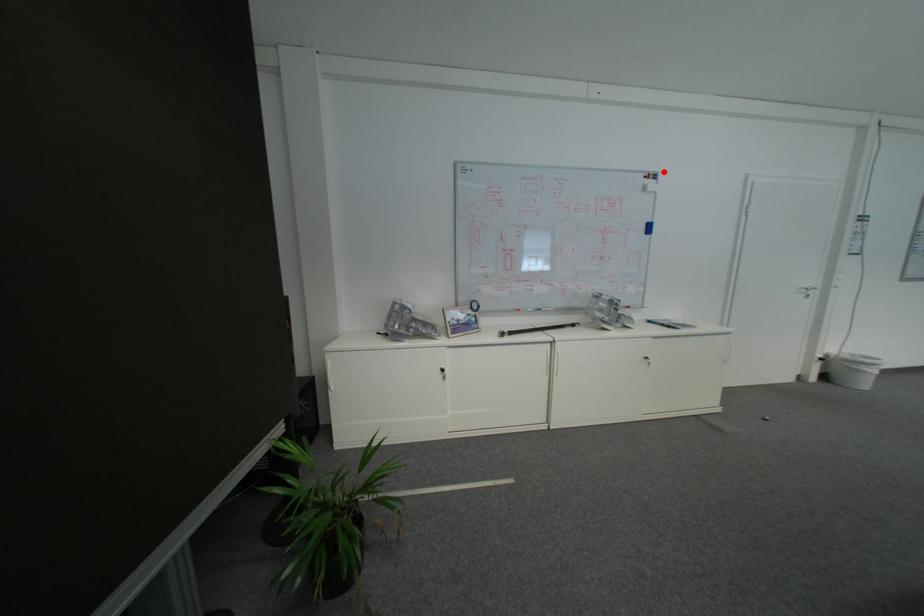
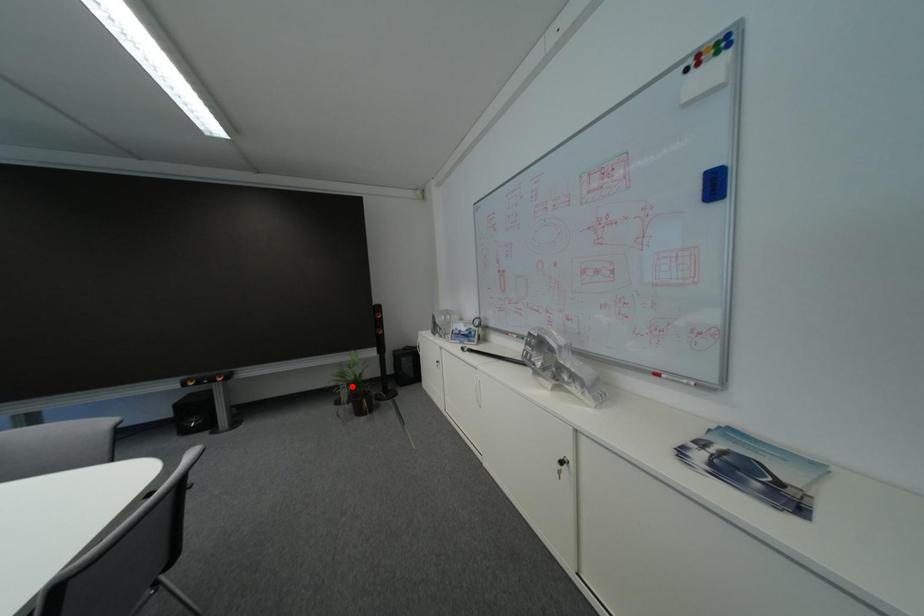
I am providing you with two images of the same scene from different viewpoints. A red point is marked on the first image and another point is marked on the second image. Are the points marked in image1 and image2 representing the same 3D position?

No